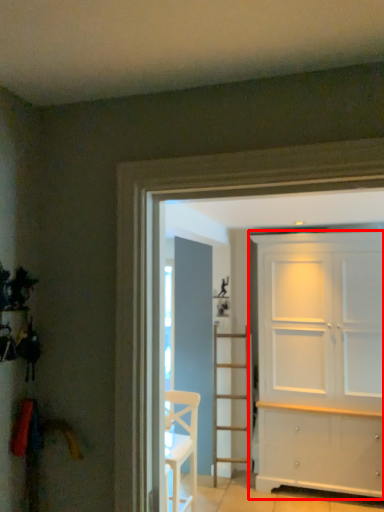
Question: From the image's perspective, considering the relative positions of door (annotated by the red box) and chair in the image provided, where is door (annotated by the red box) located with respect to the staircase?

Choices:
 (A) above
 (B) below

Answer: (A)